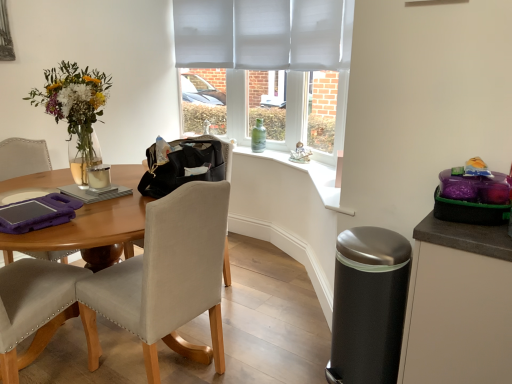
Question: Considering the relative positions of matte black cabinet at right and satin black trash can at lower right in the image provided, is matte black cabinet at right to the left of satin black trash can at lower right from the viewer's perspective?

Choices:
 (A) no
 (B) yes

Answer: (A)

Question: Considering the relative sizes of matte black cabinet at right and satin black trash can at lower right in the image provided, is matte black cabinet at right taller than satin black trash can at lower right?

Choices:
 (A) yes
 (B) no

Answer: (A)

Question: From a real-world perspective, is matte black cabinet at right over satin black trash can at lower right?

Choices:
 (A) yes
 (B) no

Answer: (A)

Question: Considering the relative positions of matte black cabinet at right and satin black trash can at lower right in the image provided, is matte black cabinet at right to the right of satin black trash can at lower right from the viewer's perspective?

Choices:
 (A) no
 (B) yes

Answer: (B)

Question: Is matte black cabinet at right shorter than satin black trash can at lower right?

Choices:
 (A) yes
 (B) no

Answer: (B)

Question: Is point (222, 357) positioned closer to the camera than point (152, 175)?

Choices:
 (A) closer
 (B) farther

Answer: (B)

Question: Is beige fabric chair at left taller or shorter than black leather handbag at center?

Choices:
 (A) tall
 (B) short

Answer: (A)

Question: Do you think beige fabric chair at left is within black leather handbag at center, or outside of it?

Choices:
 (A) inside
 (B) outside

Answer: (B)

Question: Considering their positions, is beige fabric chair at left located in front of or behind black leather handbag at center?

Choices:
 (A) behind
 (B) front

Answer: (B)

Question: Is green glass bottle at window inside the boundaries of beige fabric chair at left, or outside?

Choices:
 (A) outside
 (B) inside

Answer: (A)

Question: Considering their positions, is green glass bottle at window located in front of or behind beige fabric chair at left?

Choices:
 (A) behind
 (B) front

Answer: (A)

Question: From the image's perspective, is green glass bottle at window above or below beige fabric chair at left?

Choices:
 (A) above
 (B) below

Answer: (A)

Question: Is green glass bottle at window wider or thinner than beige fabric chair at left?

Choices:
 (A) wide
 (B) thin

Answer: (B)

Question: In terms of height, does green glass bottle at window look taller or shorter compared to matte white mug at table?

Choices:
 (A) short
 (B) tall

Answer: (B)

Question: Visually, is green glass bottle at window positioned to the left or to the right of matte white mug at table?

Choices:
 (A) left
 (B) right

Answer: (B)